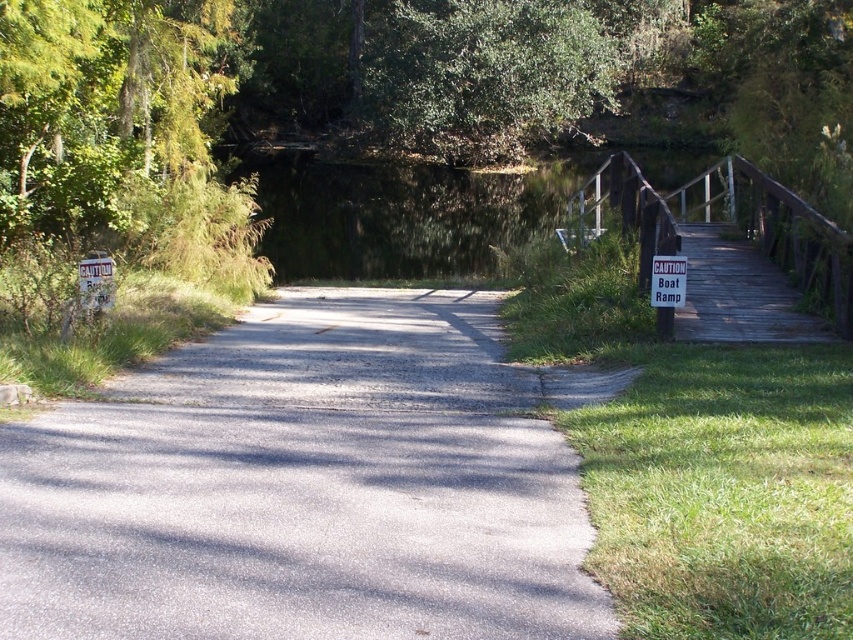
Question: Is green leafy tree at upper center above wooden bridge at right?

Choices:
 (A) yes
 (B) no

Answer: (A)

Question: Which of the following is the closest to the observer?

Choices:
 (A) gray asphalt road at center
 (B) white paper sign at right
 (C) green leafy tree at upper center

Answer: (A)

Question: Considering the relative positions of gray asphalt road at center and white paper sign at right in the image provided, where is gray asphalt road at center located with respect to white paper sign at right?

Choices:
 (A) left
 (B) right

Answer: (A)

Question: Among these objects, which one is farthest from the camera?

Choices:
 (A) white paper sign at right
 (B) green leafy tree at upper center
 (C) gray asphalt road at center

Answer: (B)

Question: Does gray asphalt road at center appear over wooden bridge at right?

Choices:
 (A) yes
 (B) no

Answer: (B)

Question: Among these points, which one is farthest from the camera?

Choices:
 (A) (444, 588)
 (B) (567, 35)
 (C) (651, 289)

Answer: (B)